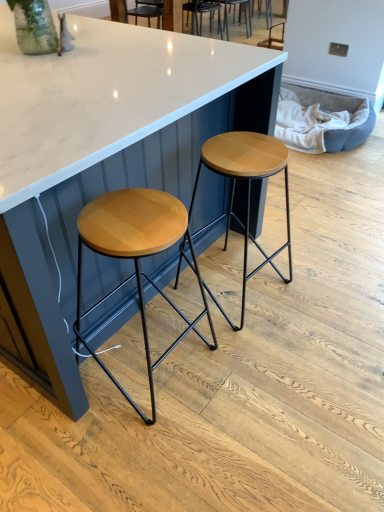
Where is `vacant area that lies to the right of woodenmaterial/texturestool at left, arranged as the first stool when viewed from the left`? Image resolution: width=384 pixels, height=512 pixels. vacant area that lies to the right of woodenmaterial/texturestool at left, arranged as the first stool when viewed from the left is located at coordinates (236, 377).